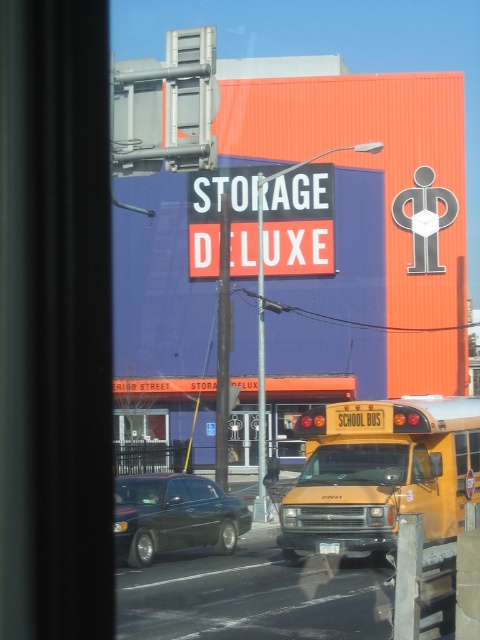
You are a delivery driver who needs to park your vehicle in this area. The red matte sign at center indicates a no parking zone. Can you park your shiny black sedan at lower left in this spot without violating the no parking rule?

The red matte sign at center has a smaller size compared to shiny black sedan at lower left. Since the sign indicates a no parking zone, you cannot park the shiny black sedan at lower left in this spot as it would be violating the rule.

You are a delivery driver who needs to park your truck in the parking lot behind the shiny black sedan at lower left. The parking space is only 2 meters tall. Can your truck, which is 2.5 meters tall, fit into the space without hitting the red matte sign at center?

The red matte sign at center has a lesser height compared to shiny black sedan at lower left. Since the parking space is only 2 meters tall and the truck is 2.5 meters tall, the truck cannot fit without hitting the sign or the sedan. However, since the sign is shorter than the sedan, it might be possible to avoid the sign but would still hit the sedan. Therefore, the truck cannot safely fit into the space.